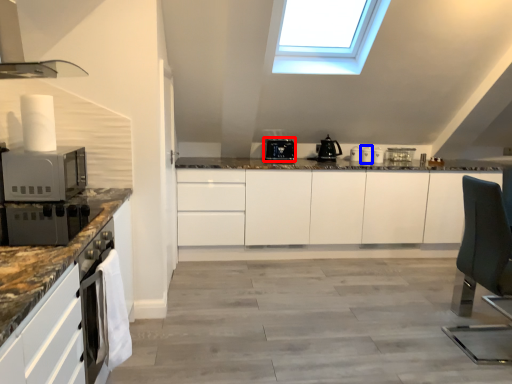
Question: Which point is further to the camera, kitchen appliance (highlighted by a red box) or appliance (highlighted by a blue box)?

Choices:
 (A) kitchen appliance
 (B) appliance

Answer: (B)